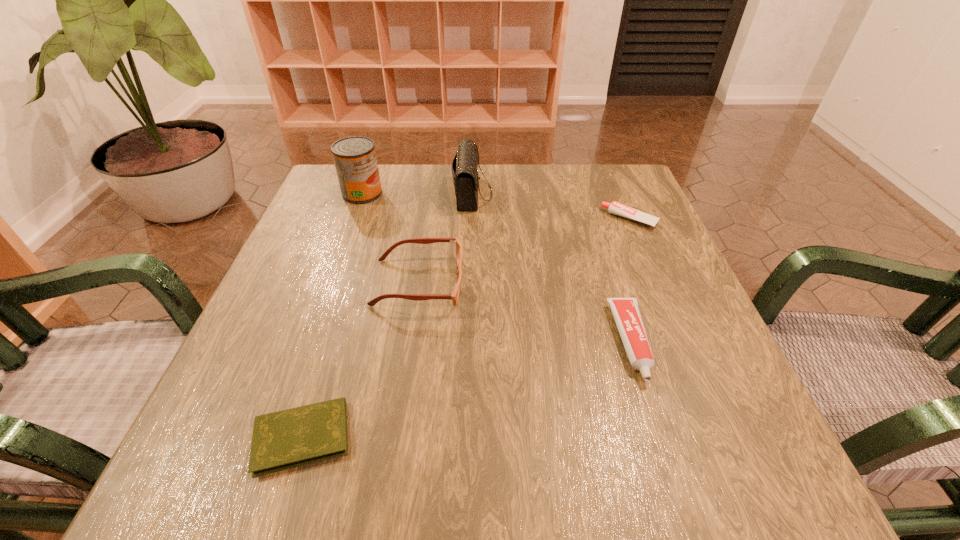
At what (x,y) coordinates should I click in order to perform the action: click on diary positioned at the left edge. Please return your answer as a coordinate pair (x, y). This screenshot has height=540, width=960. Looking at the image, I should click on (286, 439).

What are the coordinates of `object located in the far left corner section of the desktop` in the screenshot? It's located at (355, 160).

The image size is (960, 540). I want to click on object at the near left corner, so click(286, 439).

Find the location of a particular element. object that is positioned at the far right corner is located at coordinates (616, 208).

In the image, there is a desktop. At what (x,y) coordinates should I click in order to perform the action: click on vacant area at the far edge. Please return your answer as a coordinate pair (x, y). Looking at the image, I should click on coord(491,176).

Locate an element on the screen. The width and height of the screenshot is (960, 540). vacant area at the near edge of the desktop is located at coordinates (620, 468).

Find the location of a particular element. This screenshot has width=960, height=540. blank area at the left edge is located at coordinates pyautogui.click(x=342, y=274).

Image resolution: width=960 pixels, height=540 pixels. In order to click on vacant area at the right edge of the desktop in this screenshot , I will do `click(669, 309)`.

At what (x,y) coordinates should I click in order to perform the action: click on vacant space at the far left corner of the desktop. Please return your answer as a coordinate pair (x, y). Looking at the image, I should click on (381, 184).

Identify the location of free space at the near left corner of the desktop. This screenshot has width=960, height=540. (209, 471).